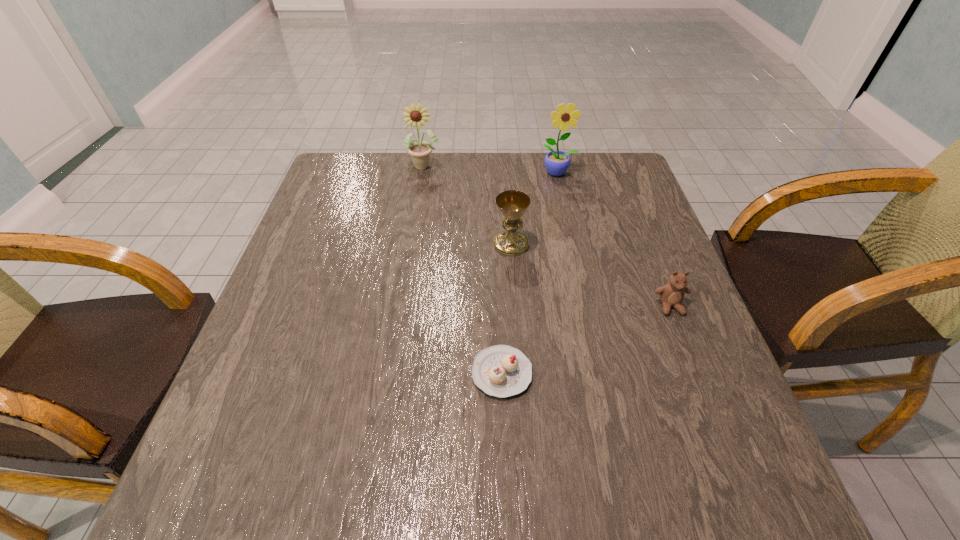
The width and height of the screenshot is (960, 540). In order to click on the second object from right to left in this screenshot , I will do `click(557, 162)`.

This screenshot has width=960, height=540. I want to click on the left sunflower, so click(415, 116).

Find the location of a particular element. This screenshot has height=540, width=960. the third tallest object is located at coordinates (512, 204).

At what (x,y) coordinates should I click in order to perform the action: click on the third farthest object. Please return your answer as a coordinate pair (x, y). Image resolution: width=960 pixels, height=540 pixels. Looking at the image, I should click on (512, 204).

Where is `the rightmost object`? the rightmost object is located at coordinates (671, 294).

Find the location of `the fourth farthest object`. the fourth farthest object is located at coordinates (671, 294).

The image size is (960, 540). What are the coordinates of `the shortest object` in the screenshot? It's located at (502, 371).

Where is `the nearest object`? the nearest object is located at coordinates (502, 371).

Where is `vacant space situated 0.330m on the front-facing side of the right sunflower`? The width and height of the screenshot is (960, 540). vacant space situated 0.330m on the front-facing side of the right sunflower is located at coordinates (577, 258).

In order to click on vacant position located on the front-facing side of the left sunflower in this screenshot , I will do `click(414, 232)`.